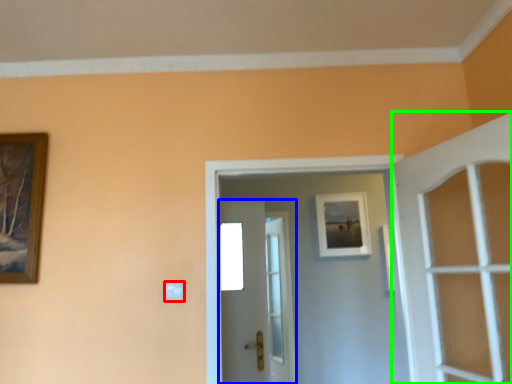
Question: Which is nearer to the light switch (highlighted by a red box)? door (highlighted by a blue box) or door (highlighted by a green box).

Choices:
 (A) door
 (B) door

Answer: (B)